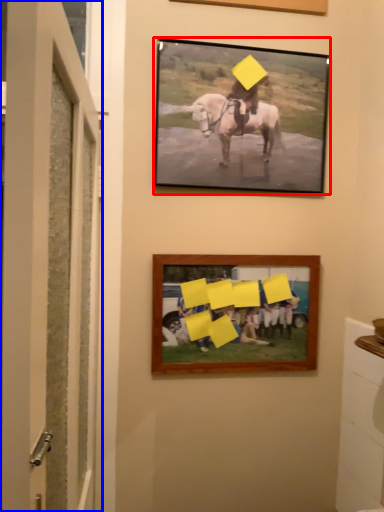
Question: Among these objects, which one is farthest to the camera, picture frame (highlighted by a red box) or door (highlighted by a blue box)?

Choices:
 (A) picture frame
 (B) door

Answer: (A)